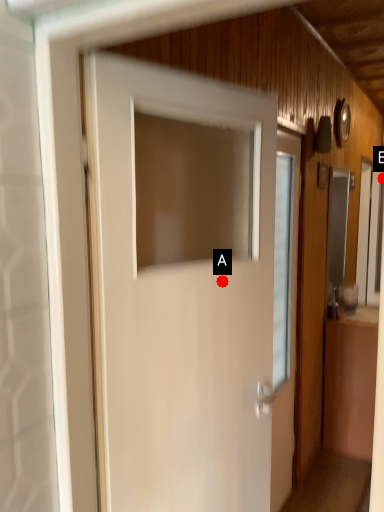
Question: Two points are circled on the image, labeled by A and B beside each circle. Which of the following is the farthest from the observer?

Choices:
 (A) A is further
 (B) B is further

Answer: (B)